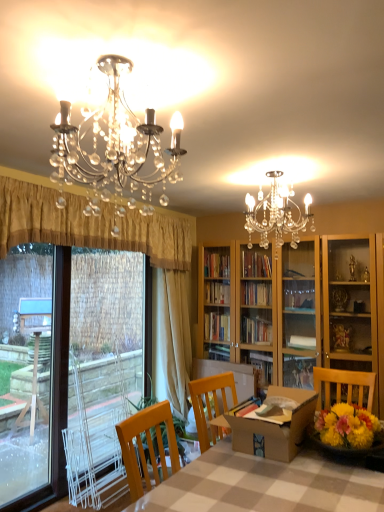
Image resolution: width=384 pixels, height=512 pixels. In order to click on gold pleated curtain at left, the second curtain positioned from the back in this screenshot , I will do `click(90, 225)`.

In the scene shown: What is the approximate width of beige fabric curtain at left, acting as the 2th curtain starting from the front?

9.98 inches.

Measure the distance between point (160, 349) and camera.

Point (160, 349) and camera are 3.90 meters apart from each other.

I want to click on clear plastic screen door at left, so click(x=102, y=372).

From the image's perspective, would you say beige fabric curtain at left, acting as the 1th curtain starting from the back, is positioned over gold pleated curtain at left, placed as the 1th curtain when sorted from front to back?

No, from the image's perspective, beige fabric curtain at left, acting as the 1th curtain starting from the back, is not over gold pleated curtain at left, placed as the 1th curtain when sorted from front to back.

Does point (178, 277) appear closer or farther from the camera than point (136, 239)?

Clearly, point (178, 277) is more distant from the camera than point (136, 239).

Is beige fabric curtain at left, acting as the 2th curtain starting from the front, directly adjacent to gold pleated curtain at left, placed as the 1th curtain when sorted from front to back?

No, beige fabric curtain at left, acting as the 2th curtain starting from the front, is not next to gold pleated curtain at left, placed as the 1th curtain when sorted from front to back.

From a real-world perspective, is beige fabric curtain at left, acting as the 1th curtain starting from the back, under gold pleated curtain at left, placed as the 1th curtain when sorted from front to back?

Yes, from a real-world perspective, beige fabric curtain at left, acting as the 1th curtain starting from the back, is under gold pleated curtain at left, placed as the 1th curtain when sorted from front to back.

Can you tell me how much gold pleated curtain at left, placed as the 1th curtain when sorted from front to back, and checkered fabric table at center differ in facing direction?

The angular difference between gold pleated curtain at left, placed as the 1th curtain when sorted from front to back, and checkered fabric table at center is 179 degrees.

From a real-world perspective, which is physically above, gold pleated curtain at left, the second curtain positioned from the back, or checkered fabric table at center?

gold pleated curtain at left, the second curtain positioned from the back, is physically above.

Which object is further away from the camera, gold pleated curtain at left, placed as the 1th curtain when sorted from front to back, or checkered fabric table at center?

gold pleated curtain at left, placed as the 1th curtain when sorted from front to back.

Can you confirm if gold pleated curtain at left, placed as the 1th curtain when sorted from front to back, is bigger than checkered fabric table at center?

Actually, gold pleated curtain at left, placed as the 1th curtain when sorted from front to back, might be smaller than checkered fabric table at center.

Considering the positions of objects brown cardboard box at center and gold pleated curtain at left, placed as the 1th curtain when sorted from front to back, in the image provided, who is more to the right, brown cardboard box at center or gold pleated curtain at left, placed as the 1th curtain when sorted from front to back,?

brown cardboard box at center.

From the image's perspective, is brown cardboard box at center located above or below gold pleated curtain at left, placed as the 1th curtain when sorted from front to back?

Clearly, from the image's perspective, brown cardboard box at center is below gold pleated curtain at left, placed as the 1th curtain when sorted from front to back.

Considering the sizes of objects brown cardboard box at center and gold pleated curtain at left, the second curtain positioned from the back, in the image provided, who is thinner, brown cardboard box at center or gold pleated curtain at left, the second curtain positioned from the back,?

Thinner between the two is gold pleated curtain at left, the second curtain positioned from the back.

Which object is further away from the camera, brown cardboard box at center or gold pleated curtain at left, placed as the 1th curtain when sorted from front to back?

gold pleated curtain at left, placed as the 1th curtain when sorted from front to back, is further from the camera.

How many degrees apart are the facing directions of beige fabric curtain at left, acting as the 1th curtain starting from the back, and clear plastic screen door at left?

The angle between the facing direction of beige fabric curtain at left, acting as the 1th curtain starting from the back, and the facing direction of clear plastic screen door at left is 2.76 degrees.

From a real-world perspective, which is physically below, beige fabric curtain at left, acting as the 1th curtain starting from the back, or clear plastic screen door at left?

In real-world perspective, clear plastic screen door at left is lower.

In the scene shown: Is beige fabric curtain at left, acting as the 1th curtain starting from the back, not within clear plastic screen door at left?

Absolutely, beige fabric curtain at left, acting as the 1th curtain starting from the back, is external to clear plastic screen door at left.

Is beige fabric curtain at left, acting as the 2th curtain starting from the front, to the left of brown cardboard box at center from the viewer's perspective?

Yes.

Is brown cardboard box at center at the back of beige fabric curtain at left, acting as the 1th curtain starting from the back?

No, beige fabric curtain at left, acting as the 1th curtain starting from the back,'s orientation is not away from brown cardboard box at center.

From a real-world perspective, is beige fabric curtain at left, acting as the 2th curtain starting from the front, physically above brown cardboard box at center?

Indeed, from a real-world perspective, beige fabric curtain at left, acting as the 2th curtain starting from the front, stands above brown cardboard box at center.

How distant is beige fabric curtain at left, acting as the 1th curtain starting from the back, from brown cardboard box at center?

→ The distance of beige fabric curtain at left, acting as the 1th curtain starting from the back, from brown cardboard box at center is 4.81 feet.

From the image's perspective, is brown cardboard box at center located above or below clear plastic screen door at left?

Based on their image positions, brown cardboard box at center is located beneath clear plastic screen door at left.

Is brown cardboard box at center not near clear plastic screen door at left?

brown cardboard box at center is positioned a significant distance from clear plastic screen door at left.

Is brown cardboard box at center inside the boundaries of clear plastic screen door at left, or outside?

brown cardboard box at center is not inside clear plastic screen door at left, it's outside.

Is point (299, 408) positioned in front of point (143, 356)?

Yes, it is in front of point (143, 356).

I want to click on curtain that appears on the left of beige fabric curtain at left, acting as the 2th curtain starting from the front, so click(x=90, y=225).

Considering the relative sizes of gold pleated curtain at left, the second curtain positioned from the back, and beige fabric curtain at left, acting as the 1th curtain starting from the back, in the image provided, is gold pleated curtain at left, the second curtain positioned from the back, thinner than beige fabric curtain at left, acting as the 1th curtain starting from the back,?

No, gold pleated curtain at left, the second curtain positioned from the back, is not thinner than beige fabric curtain at left, acting as the 1th curtain starting from the back.

Is beige fabric curtain at left, acting as the 2th curtain starting from the front, surrounded by gold pleated curtain at left, placed as the 1th curtain when sorted from front to back?

No, beige fabric curtain at left, acting as the 2th curtain starting from the front, is not inside gold pleated curtain at left, placed as the 1th curtain when sorted from front to back.

From the image's perspective, which is below, gold pleated curtain at left, the second curtain positioned from the back, or beige fabric curtain at left, acting as the 1th curtain starting from the back?

From the image's view, beige fabric curtain at left, acting as the 1th curtain starting from the back, is below.

Image resolution: width=384 pixels, height=512 pixels. In order to click on curtain in front of the beige fabric curtain at left, acting as the 1th curtain starting from the back in this screenshot , I will do `click(90, 225)`.

From the checkered fabric table at center, count 1st curtains backward and point to it. Please provide its 2D coordinates.

[(90, 225)]

Considering their positions, is clear plastic screen door at left positioned further to brown cardboard box at center than checkered fabric table at center?

clear plastic screen door at left lies further to brown cardboard box at center than the other object.

Estimate the real-world distances between objects in this image. Which object is closer to beige fabric curtain at left, acting as the 1th curtain starting from the back, brown cardboard box at center or checkered fabric table at center?

brown cardboard box at center is positioned closer to the anchor beige fabric curtain at left, acting as the 1th curtain starting from the back.

Looking at the image, which one is located closer to beige fabric curtain at left, acting as the 1th curtain starting from the back, checkered fabric table at center or clear plastic screen door at left?

Based on the image, clear plastic screen door at left appears to be nearer to beige fabric curtain at left, acting as the 1th curtain starting from the back.

In the scene shown: Which object lies further to the anchor point gold pleated curtain at left, the second curtain positioned from the back, brown cardboard box at center or beige fabric curtain at left, acting as the 2th curtain starting from the front?

Based on the image, brown cardboard box at center appears to be further to gold pleated curtain at left, the second curtain positioned from the back.

Looking at the image, which one is located further to brown cardboard box at center, beige fabric curtain at left, acting as the 2th curtain starting from the front, or gold pleated curtain at left, placed as the 1th curtain when sorted from front to back?

gold pleated curtain at left, placed as the 1th curtain when sorted from front to back, is positioned further to the anchor brown cardboard box at center.

Looking at the image, which one is located further to gold pleated curtain at left, the second curtain positioned from the back, checkered fabric table at center or clear plastic screen door at left?

checkered fabric table at center lies further to gold pleated curtain at left, the second curtain positioned from the back, than the other object.

Looking at this image, which object lies nearer to the anchor point checkered fabric table at center, clear plastic screen door at left or brown cardboard box at center?

brown cardboard box at center is positioned closer to the anchor checkered fabric table at center.

Which object lies further to the anchor point brown cardboard box at center, gold pleated curtain at left, the second curtain positioned from the back, or clear plastic screen door at left?

gold pleated curtain at left, the second curtain positioned from the back, is further to brown cardboard box at center.

This screenshot has height=512, width=384. I want to click on curtain between brown cardboard box at center and beige fabric curtain at left, acting as the 1th curtain starting from the back, from front to back, so point(90,225).

Identify the location of screen door between checkered fabric table at center and beige fabric curtain at left, acting as the 2th curtain starting from the front, from front to back. The height and width of the screenshot is (512, 384). (102, 372).

Where is `round table between gold pleated curtain at left, placed as the 1th curtain when sorted from front to back, and checkered fabric table at center in the up-down direction`? This screenshot has height=512, width=384. round table between gold pleated curtain at left, placed as the 1th curtain when sorted from front to back, and checkered fabric table at center in the up-down direction is located at coordinates (275, 426).

Identify the location of round table between checkered fabric table at center and clear plastic screen door at left from front to back. (275, 426).